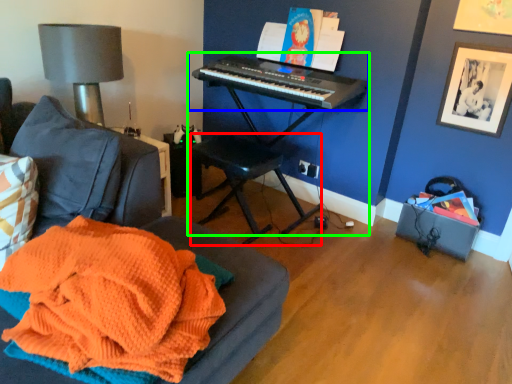
Question: Which object is positioned farthest from music stool (highlighted by a red box)? Select from musical keyboard (highlighted by a blue box) and piano (highlighted by a green box).

Choices:
 (A) musical keyboard
 (B) piano

Answer: (A)